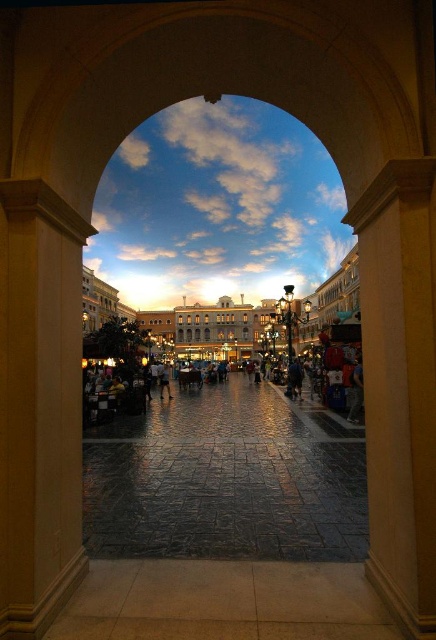
Who is positioned more to the right, smooth beige column at left or beige stone pillar at right?

beige stone pillar at right

Does smooth beige column at left have a smaller size compared to beige stone pillar at right?

Indeed, smooth beige column at left has a smaller size compared to beige stone pillar at right.

I want to click on smooth beige column at left, so click(38, 404).

Locate an element on the screen. smooth beige column at left is located at coordinates (38, 404).

Who is more distant from viewer, (79, 364) or (167, 387)?

The point (167, 387) is behind.

Can you confirm if smooth beige column at left is taller than dark blue jeans at center?

Correct, smooth beige column at left is much taller as dark blue jeans at center.

The width and height of the screenshot is (436, 640). Find the location of `smooth beige column at left`. smooth beige column at left is located at coordinates (38, 404).

Locate an element on the screen. The image size is (436, 640). smooth beige column at left is located at coordinates (38, 404).

Image resolution: width=436 pixels, height=640 pixels. I want to click on beige stone pillar at right, so click(x=399, y=385).

Is beige stone pillar at right behind dark blue jeans at center?

No, it is not.

Does point (412, 310) come in front of point (162, 364)?

Yes, point (412, 310) is closer to viewer.

The image size is (436, 640). In order to click on beige stone pillar at right in this screenshot , I will do `click(399, 385)`.